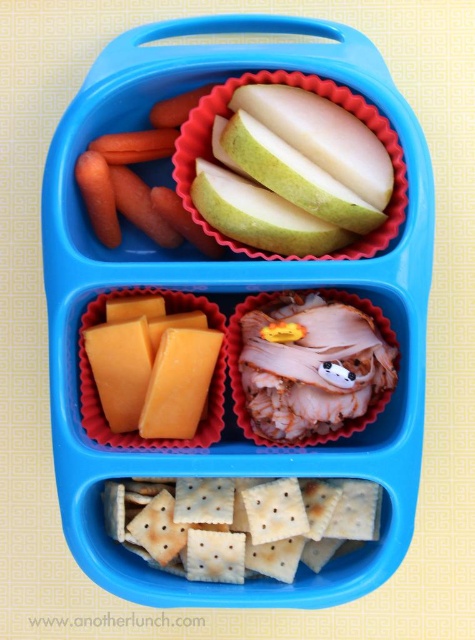
You are packing a lunchbox and want to place the orange hard cheese at lower left and orange smooth carrot at upper left closer together. How much space do you need to reduce between them?

The orange hard cheese at lower left and orange smooth carrot at upper left are currently 9.28 inches apart. To place them closer together, you need to reduce the space between them by 9.28 inches.

Looking at the bento box, which object is positioned to the left of the other between the orange hard cheese at lower left and the orange smooth carrot at upper left?

The orange hard cheese at lower left is positioned to the left of the orange smooth carrot at upper left.